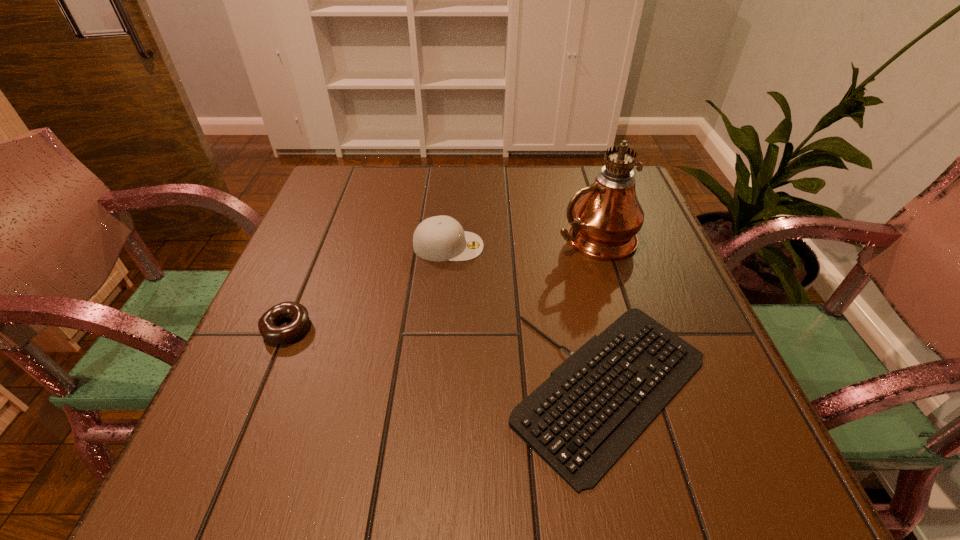
At what (x,y) coordinates should I click in order to perform the action: click on the third closest object to the oil lamp. Please return your answer as a coordinate pair (x, y). The height and width of the screenshot is (540, 960). Looking at the image, I should click on (267, 324).

In order to click on object that is the second closest to the computer keyboard in this screenshot , I will do `click(440, 238)`.

This screenshot has height=540, width=960. What are the coordinates of `free space that satisfies the following two spatial constraints: 1. on the front-facing side of the second tallest object; 2. on the right side of the computer keyboard` in the screenshot? It's located at (437, 389).

This screenshot has height=540, width=960. I want to click on free spot that satisfies the following two spatial constraints: 1. on the front-facing side of the third object from right to left; 2. on the front side of the doughnut, so click(442, 329).

Where is `vacant space that satisfies the following two spatial constraints: 1. on the front side of the doughnut; 2. on the right side of the shortest object`? vacant space that satisfies the following two spatial constraints: 1. on the front side of the doughnut; 2. on the right side of the shortest object is located at coordinates (262, 389).

I want to click on vacant area in the image that satisfies the following two spatial constraints: 1. on the front side of the third tallest object; 2. on the left side of the computer keyboard, so click(262, 389).

What are the coordinates of `vacant point that satisfies the following two spatial constraints: 1. on the front-facing side of the cap; 2. on the front side of the leftmost object` in the screenshot? It's located at (442, 329).